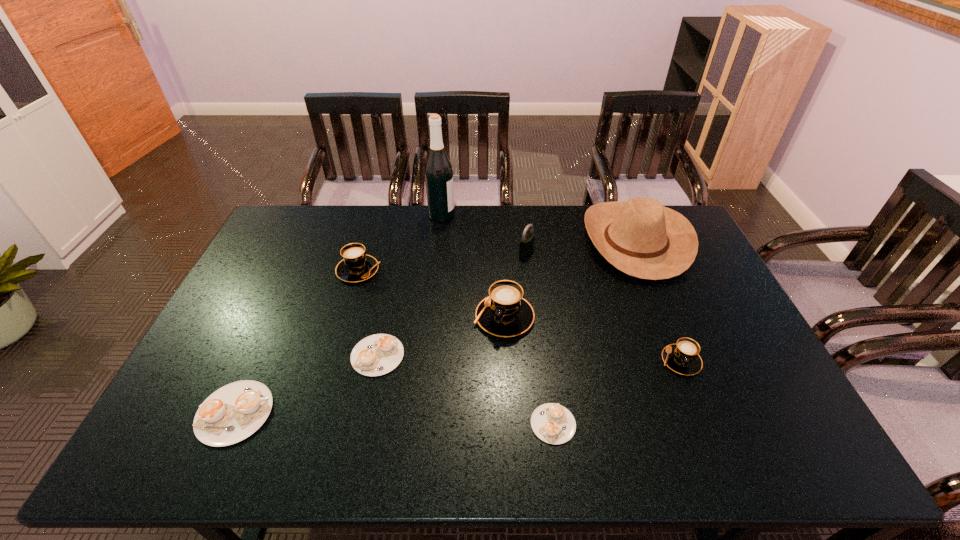
At what (x,y) coordinates should I click in order to perform the action: click on free space located on the front-facing side of the brown cowboy hat. Please return your answer as a coordinate pair (x, y). Looking at the image, I should click on (486, 241).

At what (x,y) coordinates should I click in order to perform the action: click on blank space located on the left of the padlock. Please return your answer as a coordinate pair (x, y). The image size is (960, 540). Looking at the image, I should click on (498, 251).

Identify the location of blank space located on the back of the biggest black cappuccino. (500, 251).

Identify the location of vacant space situated 0.100m on the back of the fifth tallest object. (368, 239).

Locate an element on the screen. free space located 0.050m on the left of the fourth shortest cappuccino is located at coordinates (642, 361).

Where is `vacant space located on the back of the biggest white cappuccino`? vacant space located on the back of the biggest white cappuccino is located at coordinates (276, 321).

The height and width of the screenshot is (540, 960). I want to click on free space located on the right of the second smallest white cappuccino, so click(x=462, y=355).

The width and height of the screenshot is (960, 540). I want to click on free space located on the right of the shortest object, so click(600, 424).

The image size is (960, 540). What are the coordinates of `wine bottle located in the far edge section of the desktop` in the screenshot? It's located at (438, 170).

The width and height of the screenshot is (960, 540). I want to click on cowboy hat at the far edge, so click(x=640, y=237).